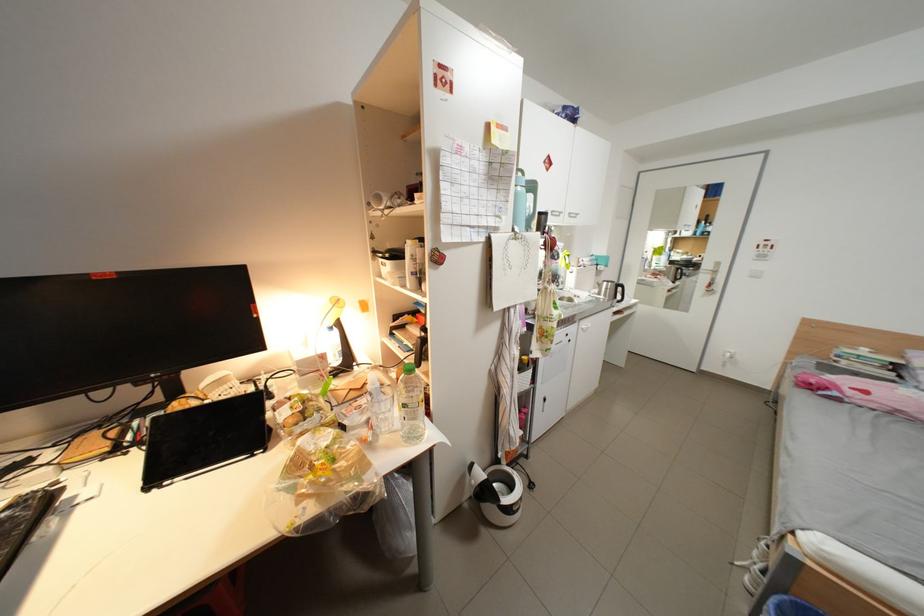
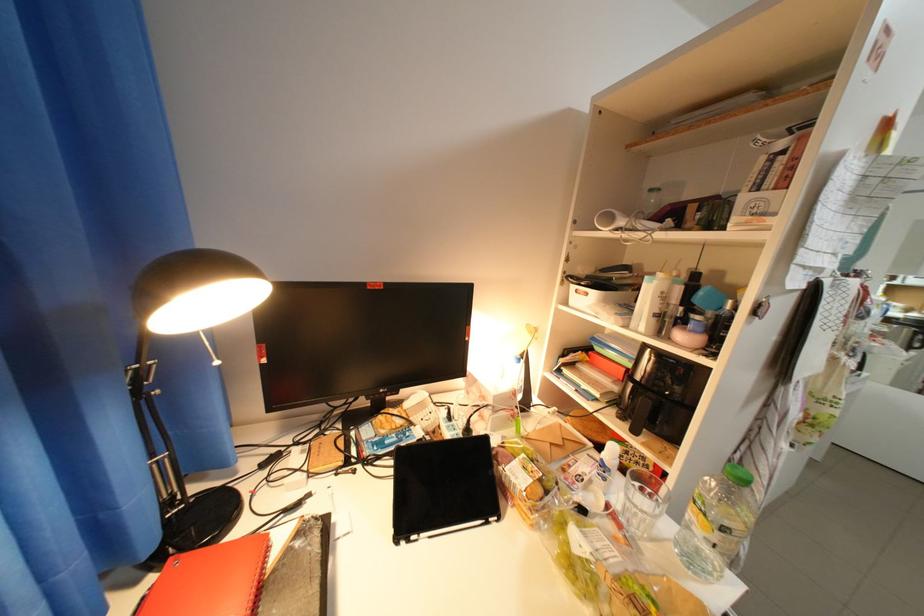
Question: Which direction would the cameraman need to move to produce the second image? Reply with the corresponding letter.

Choices:
 (A) Left
 (B) Right
 (C) Forward
 (D) Backward

Answer: (A)